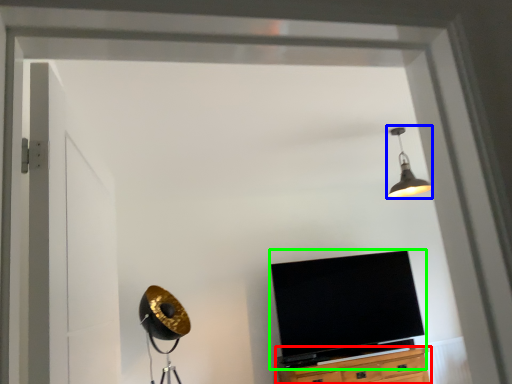
Question: Which object is positioned farthest from cabinetry (highlighted by a red box)? Select from light fixture (highlighted by a blue box) and television (highlighted by a green box).

Choices:
 (A) light fixture
 (B) television

Answer: (A)